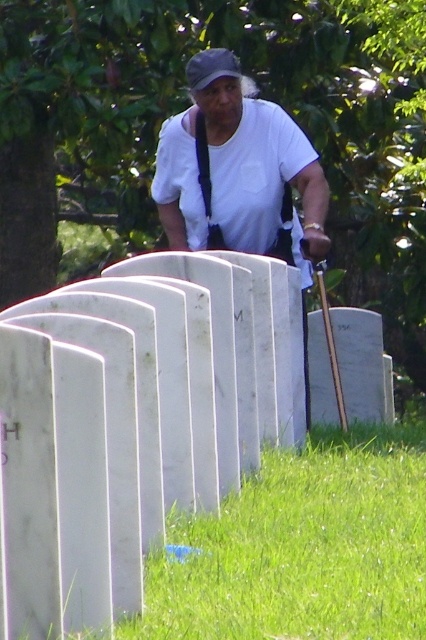
Question: Does white marble gravestones at center have a greater width compared to black fabric suspenders at upper center?

Choices:
 (A) no
 (B) yes

Answer: (B)

Question: Can you confirm if white marble gravestones at center is thinner than black fabric suspenders at upper center?

Choices:
 (A) no
 (B) yes

Answer: (A)

Question: Among these objects, which one is nearest to the camera?

Choices:
 (A) white marble gravestones at center
 (B) black fabric suspenders at upper center

Answer: (A)

Question: Does white marble gravestones at center appear under black fabric suspenders at upper center?

Choices:
 (A) no
 (B) yes

Answer: (B)